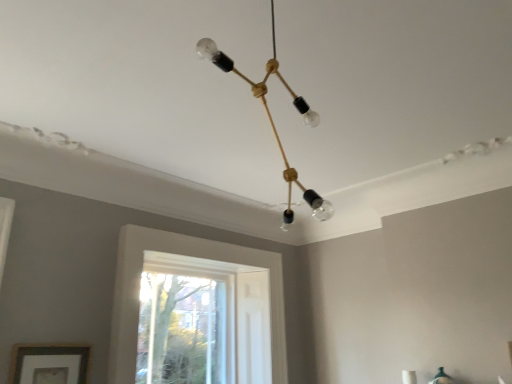
Question: Can you confirm if wooden picture frame at lower left is bigger than clear glass window at center?

Choices:
 (A) yes
 (B) no

Answer: (B)

Question: Is wooden picture frame at lower left not within clear glass window at center?

Choices:
 (A) yes
 (B) no

Answer: (A)

Question: Can you confirm if wooden picture frame at lower left is wider than clear glass window at center?

Choices:
 (A) yes
 (B) no

Answer: (B)

Question: From a real-world perspective, is wooden picture frame at lower left under clear glass window at center?

Choices:
 (A) yes
 (B) no

Answer: (A)

Question: Is wooden picture frame at lower left smaller than clear glass window at center?

Choices:
 (A) yes
 (B) no

Answer: (A)

Question: Does wooden picture frame at lower left have a lesser height compared to clear glass window at center?

Choices:
 (A) no
 (B) yes

Answer: (B)

Question: Could you tell me if clear glass bulb at center is turned towards wooden picture frame at lower left?

Choices:
 (A) yes
 (B) no

Answer: (B)

Question: Can you confirm if clear glass bulb at center is shorter than wooden picture frame at lower left?

Choices:
 (A) yes
 (B) no

Answer: (B)

Question: Can you confirm if clear glass bulb at center is positioned to the right of wooden picture frame at lower left?

Choices:
 (A) yes
 (B) no

Answer: (A)

Question: Can we say clear glass bulb at center lies outside wooden picture frame at lower left?

Choices:
 (A) no
 (B) yes

Answer: (B)

Question: Does clear glass bulb at center have a greater height compared to wooden picture frame at lower left?

Choices:
 (A) yes
 (B) no

Answer: (A)

Question: Can you confirm if clear glass bulb at center is bigger than wooden picture frame at lower left?

Choices:
 (A) yes
 (B) no

Answer: (A)

Question: Does clear glass bulb at center lie in front of clear glass window at center?

Choices:
 (A) yes
 (B) no

Answer: (A)